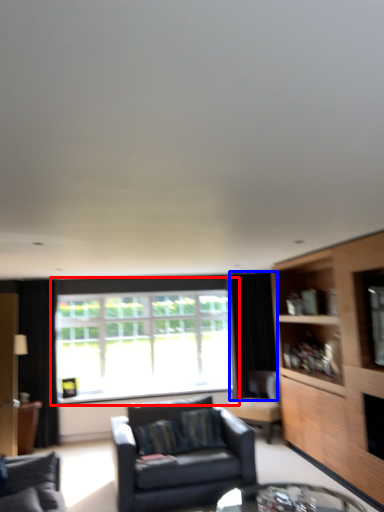
Question: Which object appears closest to the camera in this image, window (highlighted by a red box) or curtain (highlighted by a blue box)?

Choices:
 (A) window
 (B) curtain

Answer: (A)